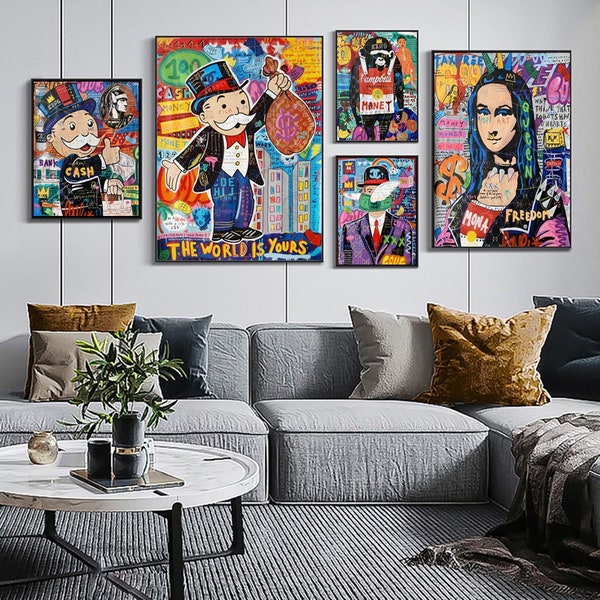
Identify the location of carpet. The height and width of the screenshot is (600, 600). (333, 542).